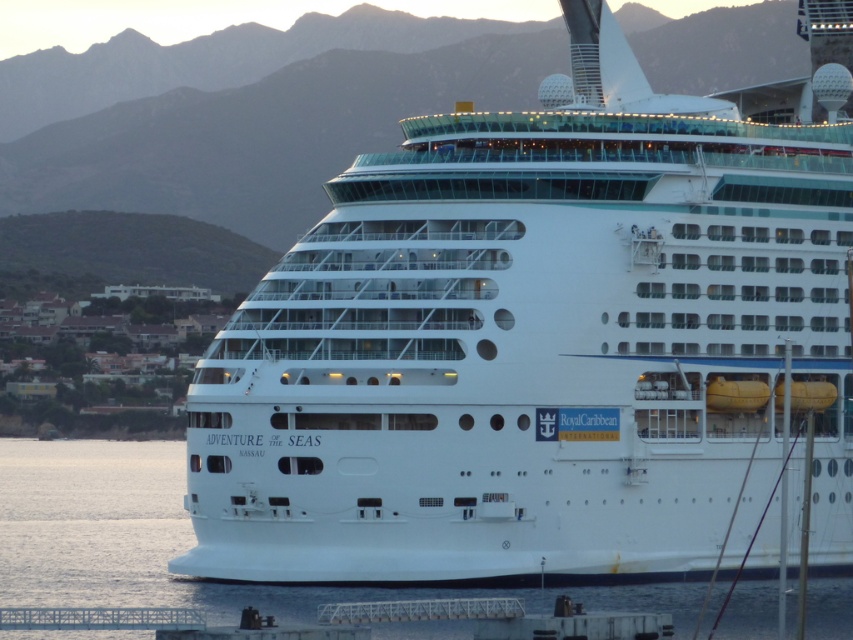
You are standing on the waterfront and see the cruise ship. Where is the point located at coordinates (537, 342) in relation to the white glossy cruise ship at center?

The point located at coordinates (537, 342) corresponds to the white glossy cruise ship at center.

You are a photographer planning to take a photo of the white glossy cruise ship at center and the clear water at lower center. Which object should you focus on first if you want to capture both in a single frame, considering their sizes?

Since the white glossy cruise ship at center is bigger than the clear water at lower center, you should focus on the white glossy cruise ship at center first to ensure it is in sharp focus, then adjust the exposure to include the clear water at lower center in the foreground.